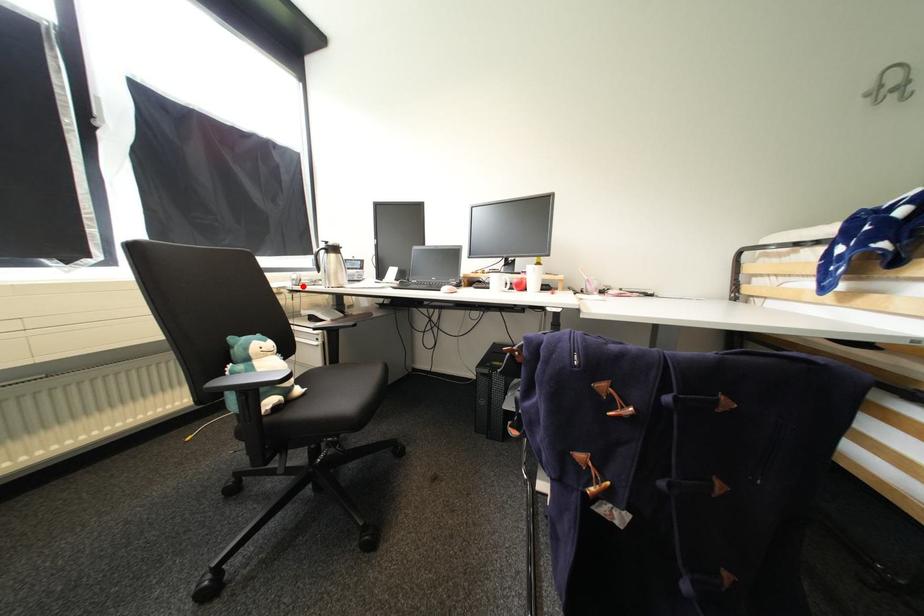
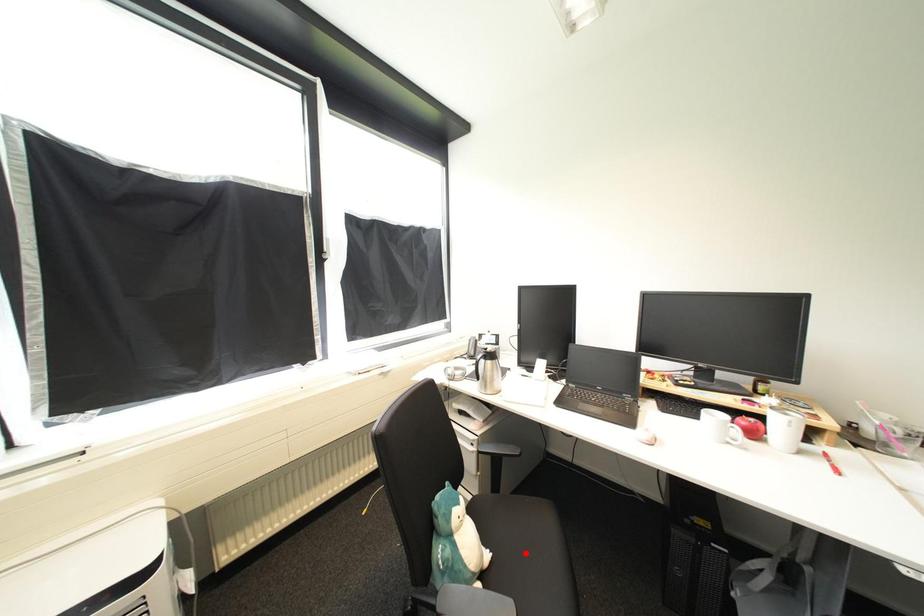
I am providing you with two images of the same scene from different viewpoints. A red point is marked on the first image and another point is marked on the second image. Is the red point in image1 aligned with the point shown in image2?

No